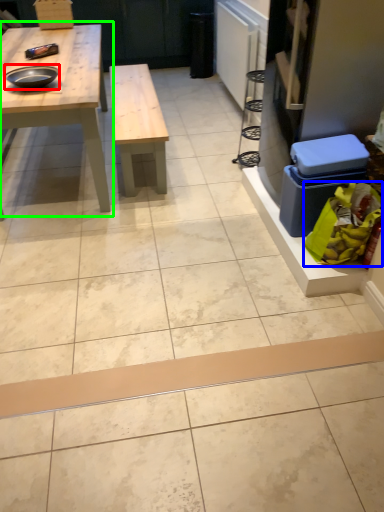
Question: Based on their relative distances, which object is farther from tray (highlighted by a red box)? Choose from food (highlighted by a blue box) and table (highlighted by a green box).

Choices:
 (A) food
 (B) table

Answer: (A)